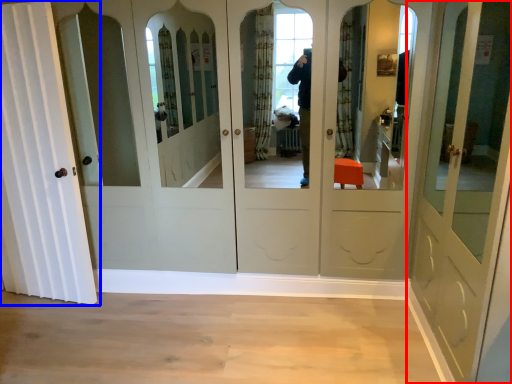
Question: Among these objects, which one is farthest to the camera, door (highlighted by a red box) or door (highlighted by a blue box)?

Choices:
 (A) door
 (B) door

Answer: (B)